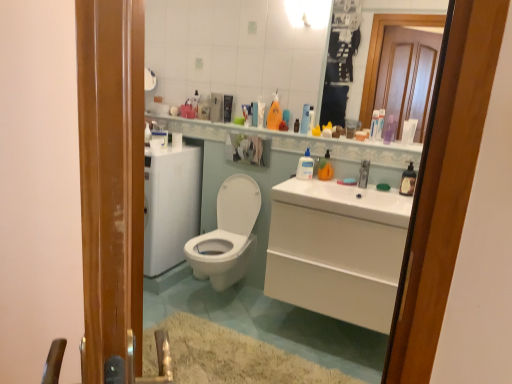
The height and width of the screenshot is (384, 512). I want to click on free space in front of white glossy sink at upper center, arranged as the 2th sink when viewed from the left, so click(x=380, y=196).